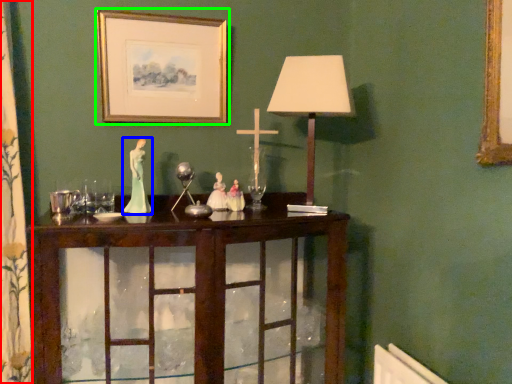
Question: Based on their relative distances, which object is nearer to curtain (highlighted by a red box)? Choose from miniature (highlighted by a blue box) and picture frame (highlighted by a green box).

Choices:
 (A) miniature
 (B) picture frame

Answer: (A)